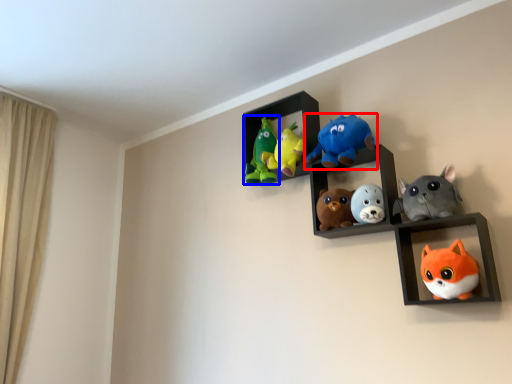
Question: Which point is closer to the camera, toy (highlighted by a red box) or toy (highlighted by a blue box)?

Choices:
 (A) toy
 (B) toy

Answer: (A)